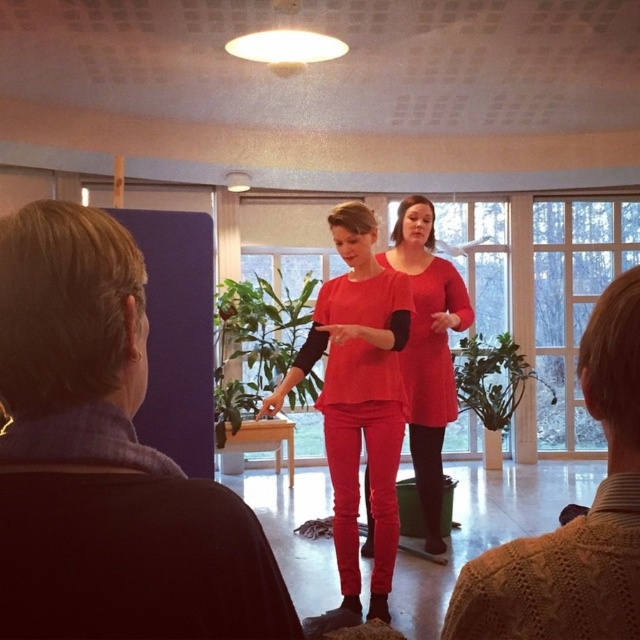
Is knitted sweater at lower right bigger than matte red dress at center?

Incorrect, knitted sweater at lower right is not larger than matte red dress at center.

Who is taller, knitted sweater at lower right or matte red dress at center?

Standing taller between the two is matte red dress at center.

What do you see at coordinates (576, 516) in the screenshot?
I see `knitted sweater at lower right` at bounding box center [576, 516].

Identify the location of knitted sweater at lower right. (576, 516).

Between dark blue wool sweater at left and knitted sweater at lower right, which one appears on the right side from the viewer's perspective?

From the viewer's perspective, knitted sweater at lower right appears more on the right side.

Can you confirm if dark blue wool sweater at left is positioned to the right of knitted sweater at lower right?

Incorrect, dark blue wool sweater at left is not on the right side of knitted sweater at lower right.

Does point (97, 236) come in front of point (625, 468)?

That is True.

Locate an element on the screen. dark blue wool sweater at left is located at coordinates (106, 460).

Does dark blue wool sweater at left have a lesser width compared to matte red dress at center?

Yes, dark blue wool sweater at left is thinner than matte red dress at center.

Does dark blue wool sweater at left appear on the left side of matte red dress at center?

Correct, you'll find dark blue wool sweater at left to the left of matte red dress at center.

Locate an element on the screen. dark blue wool sweater at left is located at coordinates (106, 460).